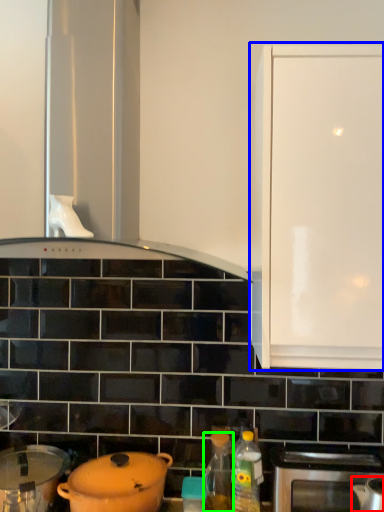
Question: Which is farther away from kitchen appliance (highlighted by a red box)? cabinetry (highlighted by a blue box) or bottle (highlighted by a green box)?

Choices:
 (A) cabinetry
 (B) bottle

Answer: (A)